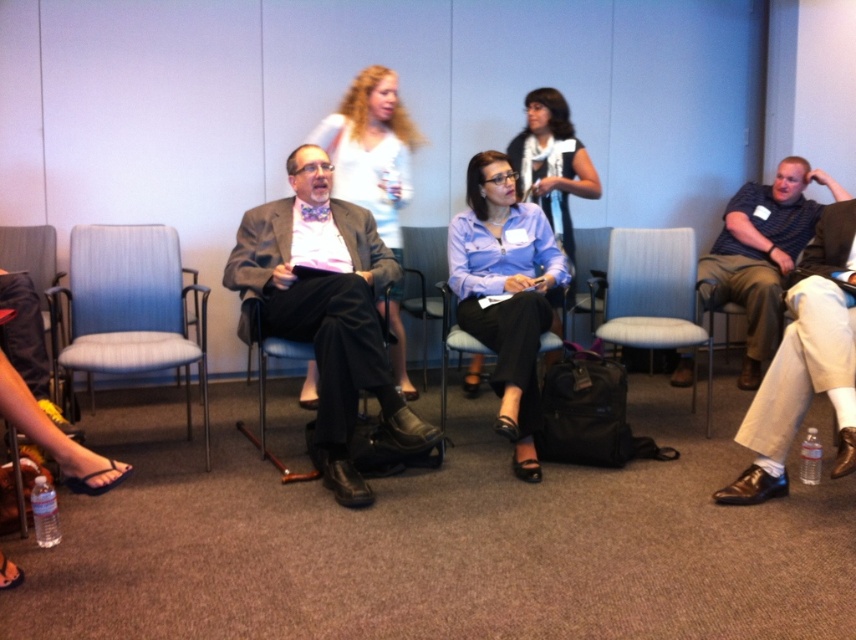
You are standing in the room and want to place a pair of shoes that are 12 inches long into the chair. Can the brown leather shoes at lower right fit into the black leather chair at center?

The brown leather shoes at lower right has a larger size compared to black leather chair at center, so the shoes may not fit into the chair.

You are attending a meeting and need to sit next to the person wearing the blue fabric shirt at center. Which direction should you move relative to the matte gray suit at center?

The matte gray suit at center is positioned on the left side of the blue fabric shirt at center, so to sit next to the blue fabric shirt at center, you should move to the right of the matte gray suit at center.